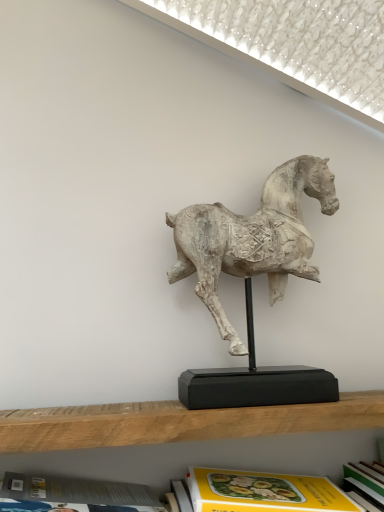
What do you see at coordinates (253, 238) in the screenshot? This screenshot has height=512, width=384. I see `white textured horse at center` at bounding box center [253, 238].

I want to click on white textured horse at center, so click(253, 238).

What is the approximate width of white textured horse at center?

It is 5.29 inches.

At what (x,y) coordinates should I click in order to perform the action: click on white textured horse at center. Please return your answer as a coordinate pair (x, y). Image resolution: width=384 pixels, height=512 pixels. Looking at the image, I should click on (253, 238).